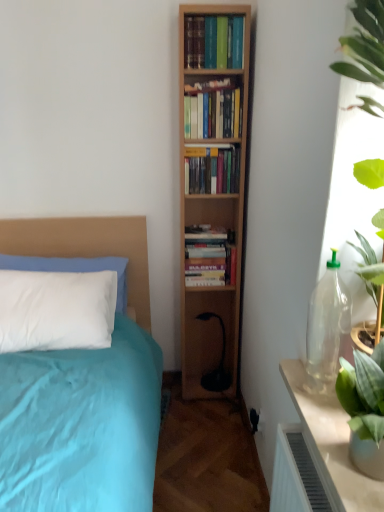
Question: Is translucent glass table at right thinner than hardcover books at center, positioned as the 1th book in top-to-bottom order?

Choices:
 (A) no
 (B) yes

Answer: (A)

Question: Would you say hardcover books at center, positioned as the 1th book in top-to-bottom order, is part of translucent glass table at right's contents?

Choices:
 (A) yes
 (B) no

Answer: (B)

Question: From the image's perspective, is translucent glass table at right above hardcover books at center, positioned as the fourth book in bottom-to-top order?

Choices:
 (A) yes
 (B) no

Answer: (B)

Question: From a real-world perspective, is translucent glass table at right physically above hardcover books at center, positioned as the fourth book in bottom-to-top order?

Choices:
 (A) yes
 (B) no

Answer: (B)

Question: Is translucent glass table at right positioned behind hardcover books at center, positioned as the 1th book in top-to-bottom order?

Choices:
 (A) no
 (B) yes

Answer: (A)

Question: Considering the positions of beige fabric headboard at left and wooden bookshelf at center, which is the 3th book from bottom to top, in the image, is beige fabric headboard at left wider or thinner than wooden bookshelf at center, which is the 3th book from bottom to top,?

Choices:
 (A) wide
 (B) thin

Answer: (A)

Question: From the image's perspective, relative to wooden bookshelf at center, which appears as the second book when viewed from the top, is beige fabric headboard at left above or below?

Choices:
 (A) above
 (B) below

Answer: (B)

Question: Is beige fabric headboard at left inside or outside of wooden bookshelf at center, which is the 3th book from bottom to top?

Choices:
 (A) outside
 (B) inside

Answer: (A)

Question: In terms of height, does beige fabric headboard at left look taller or shorter compared to wooden bookshelf at center, which appears as the second book when viewed from the top?

Choices:
 (A) short
 (B) tall

Answer: (B)

Question: From a real-world perspective, is wooden bookshelf at center, which is the 3th book from bottom to top, positioned above or below wooden bookshelf at center, the second book from the bottom?

Choices:
 (A) below
 (B) above

Answer: (B)

Question: From the image's perspective, relative to wooden bookshelf at center, the second book from the bottom, is wooden bookshelf at center, which appears as the second book when viewed from the top, above or below?

Choices:
 (A) below
 (B) above

Answer: (B)

Question: Which is correct: wooden bookshelf at center, which is the 3th book from bottom to top, is inside wooden bookshelf at center, which appears as the 3th book when viewed from the top, or outside of it?

Choices:
 (A) inside
 (B) outside

Answer: (B)

Question: In terms of width, does wooden bookshelf at center, which is the 3th book from bottom to top, look wider or thinner when compared to wooden bookshelf at center, which appears as the 3th book when viewed from the top?

Choices:
 (A) wide
 (B) thin

Answer: (B)

Question: Is hardcover books at center, which is the 1th book from bottom to top, inside or outside of hardcover books at center, positioned as the 1th book in top-to-bottom order?

Choices:
 (A) outside
 (B) inside

Answer: (A)

Question: Considering the positions of point (205, 266) and point (198, 47), is point (205, 266) closer or farther from the camera than point (198, 47)?

Choices:
 (A) closer
 (B) farther

Answer: (B)